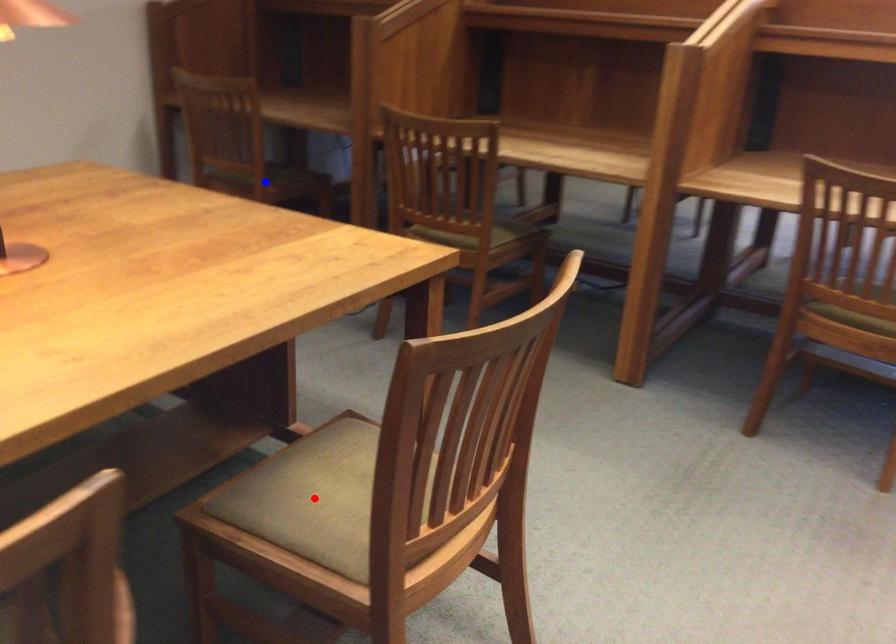
Question: Two points are marked on the image. Which point is closer to the camera?

Choices:
 (A) Blue point is closer.
 (B) Red point is closer.

Answer: (B)